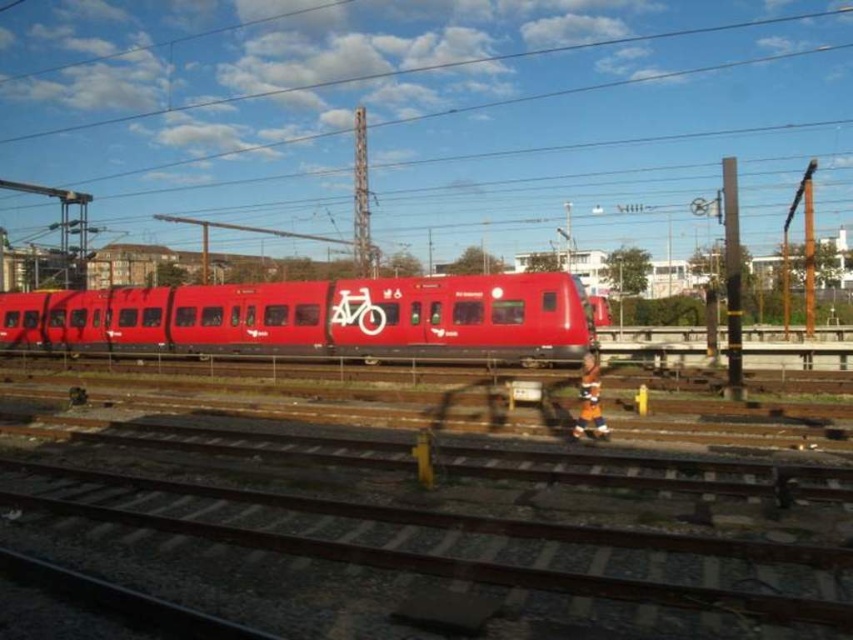
Between brown metallic track at lower center and matte red train at center, which one appears on the left side from the viewer's perspective?

From the viewer's perspective, matte red train at center appears more on the left side.

Which is in front, point (77, 452) or point (363, 349)?

Positioned in front is point (77, 452).

Is point (386, 484) closer to viewer compared to point (280, 321)?

Yes, point (386, 484) is in front of point (280, 321).

The width and height of the screenshot is (853, 640). What are the coordinates of `brown metallic track at lower center` in the screenshot? It's located at (425, 541).